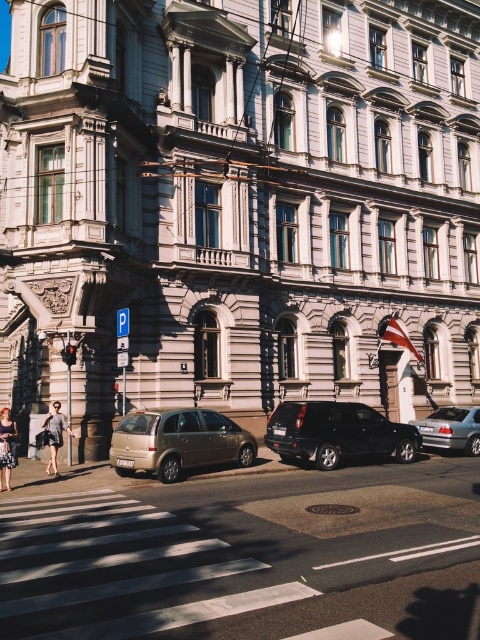
Question: Can you confirm if white asphalt at center is positioned below shiny black suv at center?

Choices:
 (A) yes
 (B) no

Answer: (A)

Question: Which of the following is the farthest from the observer?

Choices:
 (A) white asphalt at center
 (B) gold metallic minivan at center
 (C) shiny black suv at center

Answer: (C)

Question: Which point appears closest to the camera in this image?

Choices:
 (A) tap(298, 540)
 (B) tap(457, 444)
 (C) tap(195, 444)

Answer: (A)

Question: Can you confirm if white asphalt at center is thinner than gold metallic minivan at center?

Choices:
 (A) yes
 (B) no

Answer: (B)

Question: Which object appears farthest from the camera in this image?

Choices:
 (A) white asphalt at center
 (B) silver metallic sedan at center
 (C) gold metallic minivan at center
 (D) light gray fabric coat at lower left

Answer: (B)

Question: Does gold metallic minivan at center come behind shiny black suv at center?

Choices:
 (A) no
 (B) yes

Answer: (A)